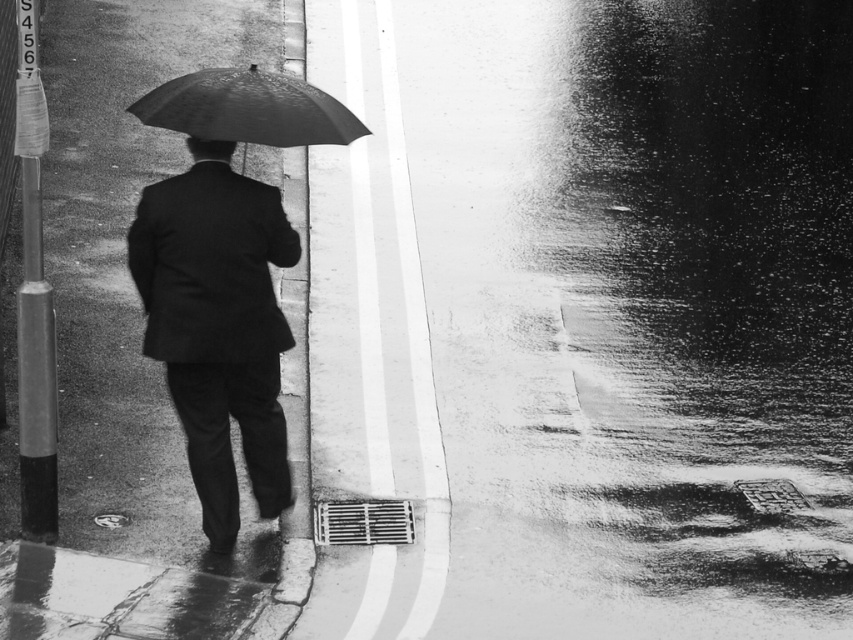
Who is shorter, matte black suit at center or shiny black umbrella at center?

With less height is shiny black umbrella at center.

Can you confirm if matte black suit at center is taller than shiny black umbrella at center?

Yes, matte black suit at center is taller than shiny black umbrella at center.

Where is `matte black suit at center`? The image size is (853, 640). matte black suit at center is located at coordinates (218, 324).

The width and height of the screenshot is (853, 640). I want to click on matte black suit at center, so click(218, 324).